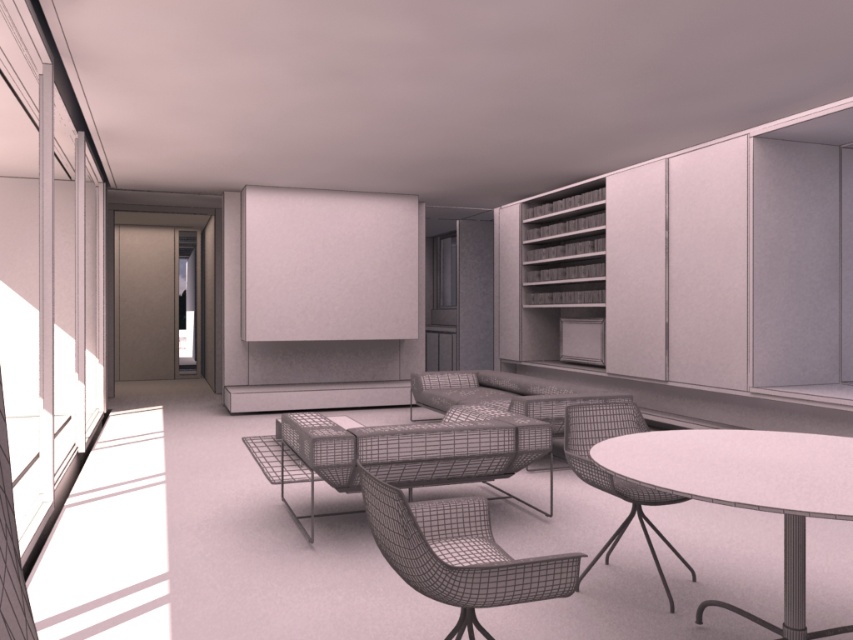
Question: Where is white mesh table at center located in relation to wireframe mesh chair at center in the image?

Choices:
 (A) above
 (B) below

Answer: (A)

Question: Where is white mesh table at center located in relation to plaid fabric couch at center in the image?

Choices:
 (A) below
 (B) above

Answer: (A)

Question: Which point is farther to the camera?

Choices:
 (A) wireframe mesh armchair at lower right
 (B) wireframe mesh chair at center
 (C) white mesh table at center
 (D) plaid fabric couch at center

Answer: (D)

Question: Among these objects, which one is farthest from the camera?

Choices:
 (A) wireframe mesh armchair at lower right
 (B) plaid fabric couch at center
 (C) wireframe mesh chair at center

Answer: (B)

Question: Is wireframe mesh chair at center wider than plaid fabric couch at center?

Choices:
 (A) yes
 (B) no

Answer: (B)

Question: Which point is farther to the camera?

Choices:
 (A) wireframe mesh armchair at lower right
 (B) white mesh table at center
 (C) wireframe mesh chair at center
 (D) plaid fabric couch at center

Answer: (D)